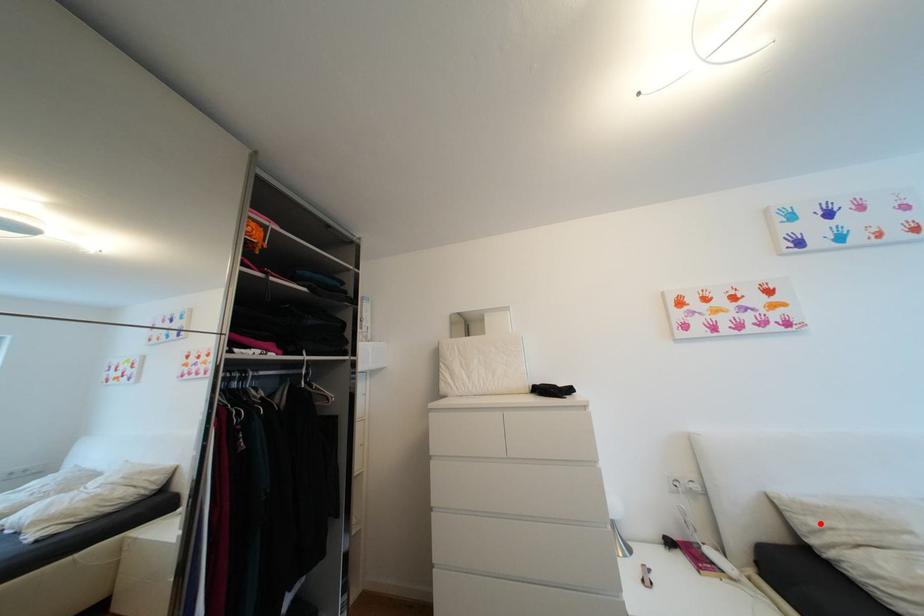
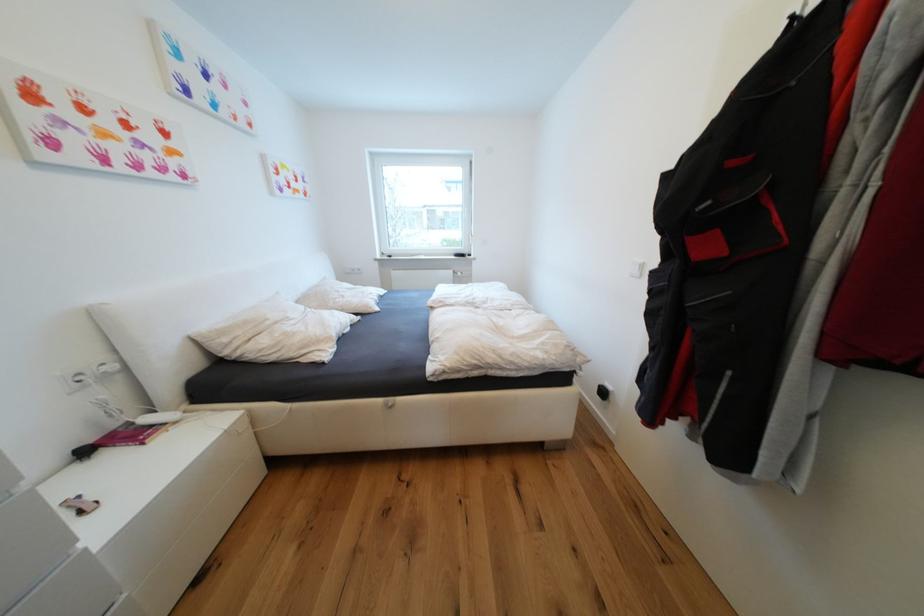
Question: I am providing you with two images of the same scene from different viewpoints. A red point is marked on the first image. At the location where the point appears in image 1, is it still visible in image 2?

Choices:
 (A) Yes
 (B) No

Answer: (A)